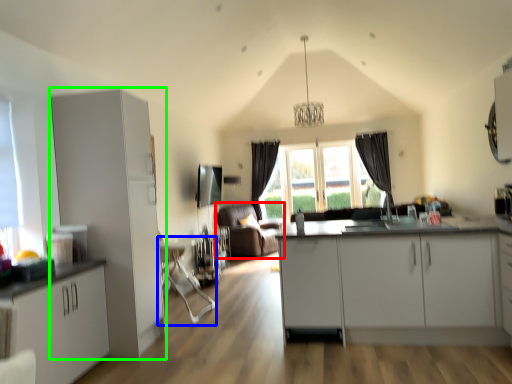
Question: Considering the real-world distances, which object is closest to couch (highlighted by a red box)? swivel chair (highlighted by a blue box) or cabinetry (highlighted by a green box).

Choices:
 (A) swivel chair
 (B) cabinetry

Answer: (A)